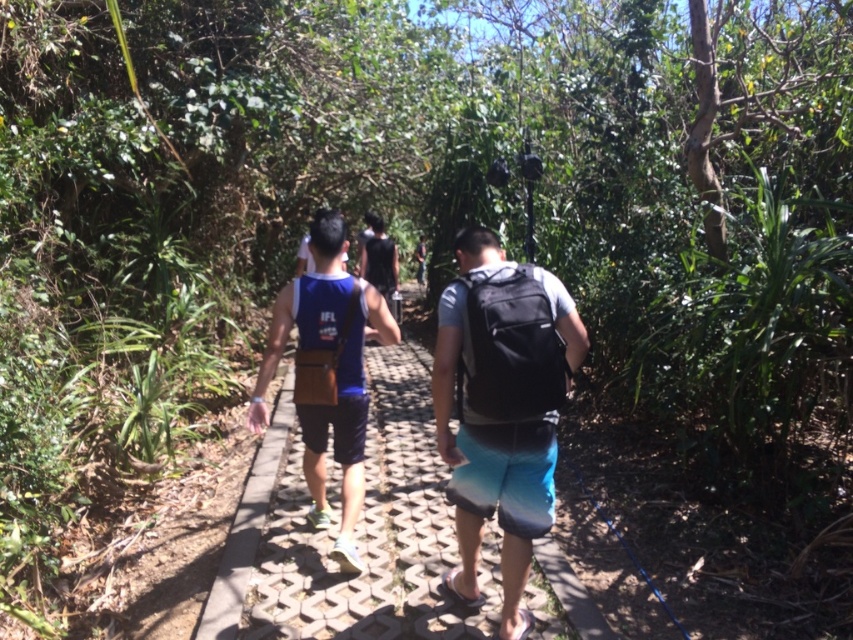
How distant is blue fabric backpack at center from blue fabric tank top at center?

The distance of blue fabric backpack at center from blue fabric tank top at center is 33.82 inches.

Does blue fabric backpack at center come in front of blue fabric tank top at center?

That is True.

Who is more forward, [521,557] or [305,330]?

Point [521,557] is more forward.

This screenshot has height=640, width=853. Identify the location of blue fabric backpack at center. (492, 490).

Which of these two, black matte backpack at center or blue fabric tank top at center, stands taller?

Standing taller between the two is blue fabric tank top at center.

Where is `black matte backpack at center`? black matte backpack at center is located at coordinates (502, 408).

Identify the location of black matte backpack at center. The height and width of the screenshot is (640, 853). (502, 408).

Does point (532, 330) lie in front of point (270, 358)?

Yes, it is in front of point (270, 358).

Does black matte backpack at center appear on the right side of blue fabric backpack at center?

In fact, black matte backpack at center is to the left of blue fabric backpack at center.

At what (x,y) coordinates should I click in order to perform the action: click on black matte backpack at center. Please return your answer as a coordinate pair (x, y). This screenshot has width=853, height=640. Looking at the image, I should click on (502, 408).